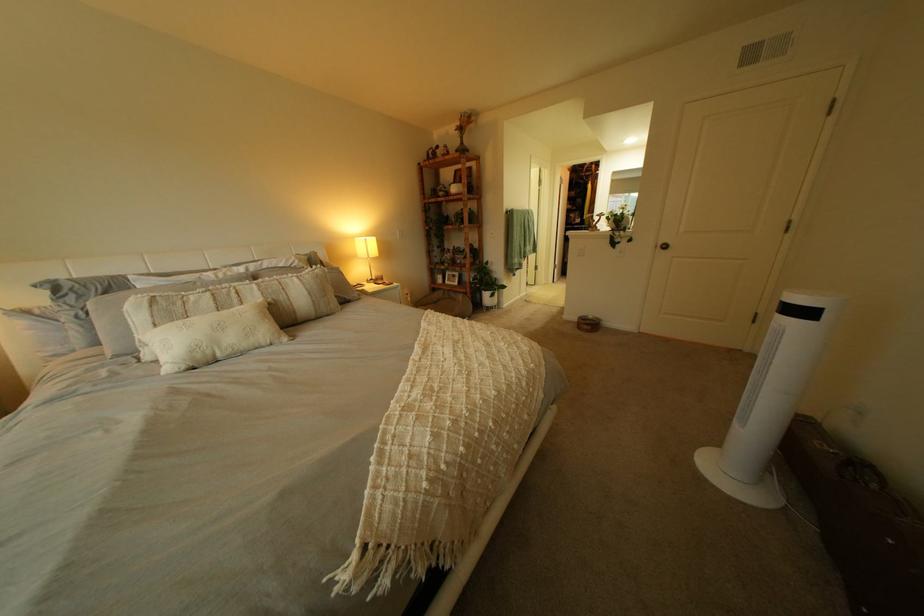
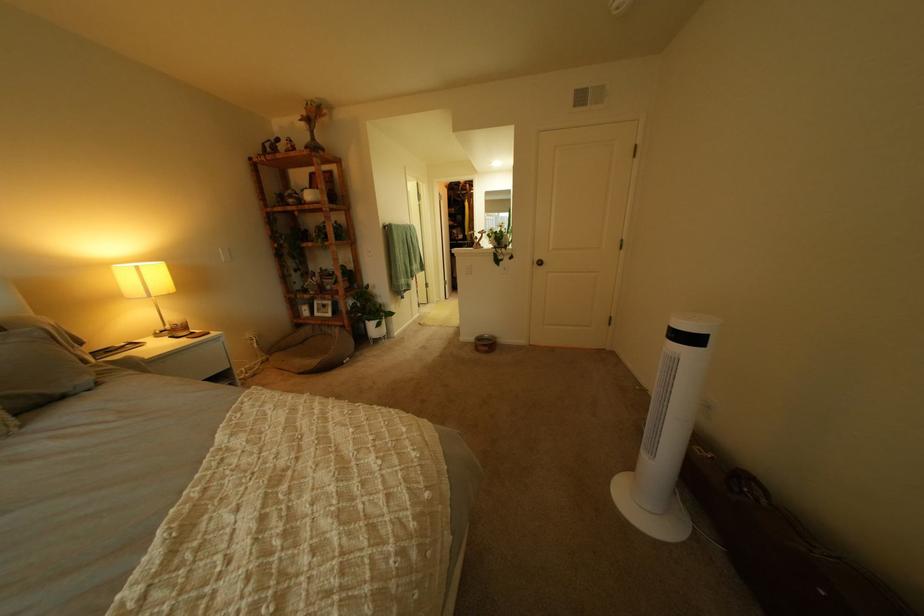
Find the pixel in the second image that matches (821,315) in the first image.

(710, 341)